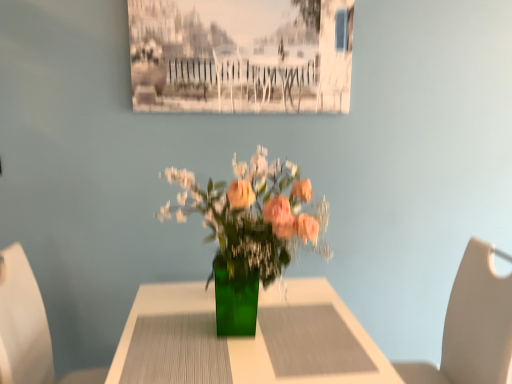
Question: Does beige leather chair at right, the first chair in the right-to-left sequence, have a smaller size compared to green glass vase at center?

Choices:
 (A) yes
 (B) no

Answer: (A)

Question: From the image's perspective, does beige leather chair at right, the 2th chair when ordered from left to right, appear higher than green glass vase at center?

Choices:
 (A) yes
 (B) no

Answer: (A)

Question: From a real-world perspective, is beige leather chair at right, the 2th chair when ordered from left to right, under green glass vase at center?

Choices:
 (A) no
 (B) yes

Answer: (A)

Question: From a real-world perspective, is beige leather chair at right, the 2th chair when ordered from left to right, positioned over green glass vase at center based on gravity?

Choices:
 (A) yes
 (B) no

Answer: (A)

Question: Is beige leather chair at right, the 2th chair when ordered from left to right, not near green glass vase at center?

Choices:
 (A) yes
 (B) no

Answer: (B)

Question: Is green glass vase at center taller or shorter than white plastic chair at left, which is counted as the first chair, starting from the left?

Choices:
 (A) tall
 (B) short

Answer: (B)

Question: Is green glass vase at center to the left or to the right of white plastic chair at left, placed as the 2th chair when sorted from right to left, in the image?

Choices:
 (A) left
 (B) right

Answer: (B)

Question: Is point (x=206, y=347) positioned closer to the camera than point (x=20, y=372)?

Choices:
 (A) closer
 (B) farther

Answer: (A)

Question: Is green glass vase at center inside the boundaries of white plastic chair at left, placed as the 2th chair when sorted from right to left, or outside?

Choices:
 (A) inside
 (B) outside

Answer: (B)

Question: From their relative heights in the image, would you say white plastic chair at left, which is counted as the first chair, starting from the left, is taller or shorter than green glass vase at center?

Choices:
 (A) short
 (B) tall

Answer: (B)

Question: Based on their sizes in the image, would you say white plastic chair at left, which is counted as the first chair, starting from the left, is bigger or smaller than green glass vase at center?

Choices:
 (A) small
 (B) big

Answer: (A)

Question: Based on their positions, is white plastic chair at left, placed as the 2th chair when sorted from right to left, located to the left or right of green glass vase at center?

Choices:
 (A) right
 (B) left

Answer: (B)

Question: In the image, is white plastic chair at left, which is counted as the first chair, starting from the left, positioned in front of or behind green glass vase at center?

Choices:
 (A) front
 (B) behind

Answer: (B)

Question: Considering the relative positions of beige leather chair at right, the first chair in the right-to-left sequence, and white plastic chair at left, placed as the 2th chair when sorted from right to left, in the image provided, is beige leather chair at right, the first chair in the right-to-left sequence, to the left or to the right of white plastic chair at left, placed as the 2th chair when sorted from right to left,?

Choices:
 (A) right
 (B) left

Answer: (A)

Question: From a real-world perspective, is beige leather chair at right, the first chair in the right-to-left sequence, above or below white plastic chair at left, which is counted as the first chair, starting from the left?

Choices:
 (A) above
 (B) below

Answer: (B)